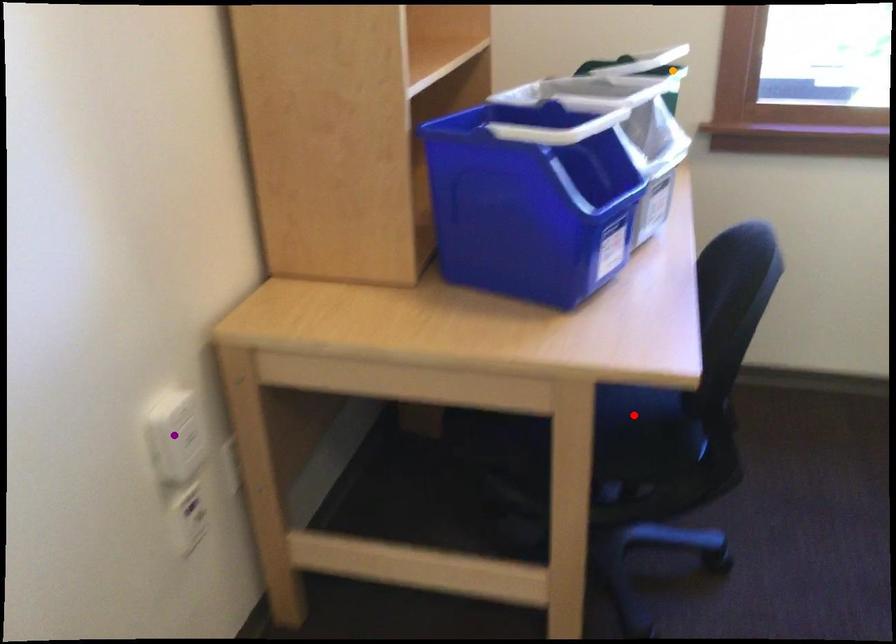
Order these from farthest to nearest:
purple point, orange point, red point

1. orange point
2. red point
3. purple point